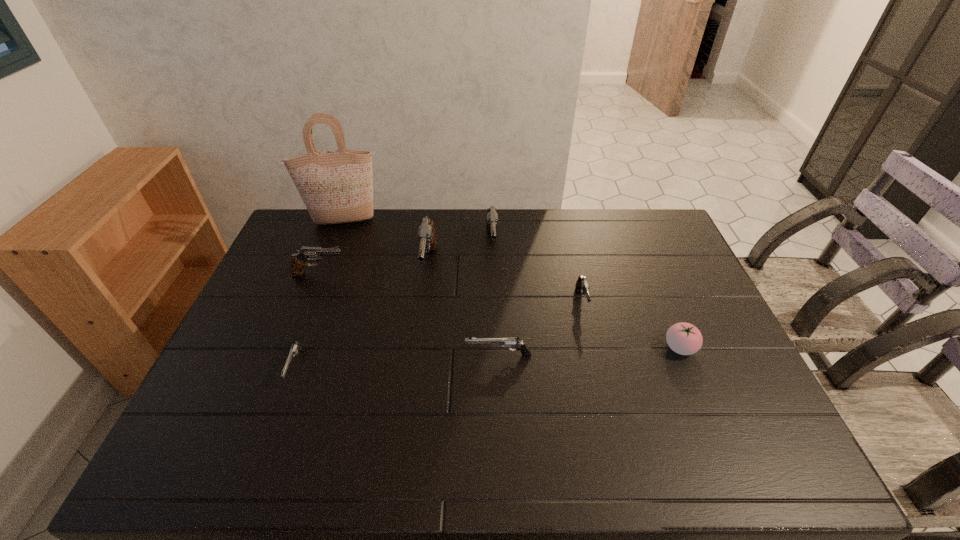
Locate an element on the screen. shopping bag is located at coordinates (336, 187).

The height and width of the screenshot is (540, 960). In order to click on the fifth object from right to left in this screenshot , I will do `click(426, 236)`.

At what (x,y) coordinates should I click in order to perform the action: click on the third gray pistol from right to left. Please return your answer as a coordinate pair (x, y). This screenshot has width=960, height=540. Looking at the image, I should click on (426, 236).

You are a GUI agent. You are given a task and a screenshot of the screen. Output one action in this format:
    pyautogui.click(x=<x>, y=<y>)
    Task: Click on the second biggest gray pistol
    The width and height of the screenshot is (960, 540).
    Given the screenshot: What is the action you would take?
    pyautogui.click(x=492, y=217)

At what (x,y) coordinates should I click in order to perform the action: click on the fifth shortest pistol. Please return your answer as a coordinate pair (x, y). The height and width of the screenshot is (540, 960). Looking at the image, I should click on (492, 217).

Identify the location of the fourth shortest pistol. (299, 260).

You are a GUI agent. You are given a task and a screenshot of the screen. Output one action in this format:
    pyautogui.click(x=<x>, y=<y>)
    Task: Click on the second smallest gray pistol
    Image resolution: width=960 pixels, height=540 pixels.
    Given the screenshot: What is the action you would take?
    pyautogui.click(x=299, y=260)

Where is `the second object from right to left`? Image resolution: width=960 pixels, height=540 pixels. the second object from right to left is located at coordinates (582, 285).

Where is `the smallest gray pistol`? Image resolution: width=960 pixels, height=540 pixels. the smallest gray pistol is located at coordinates (582, 285).

Where is `the rightmost object`? Image resolution: width=960 pixels, height=540 pixels. the rightmost object is located at coordinates (683, 338).